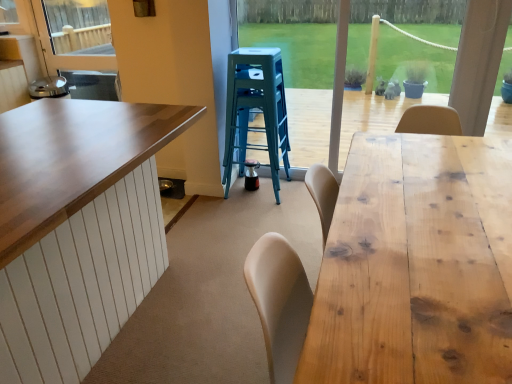
Question: Is natural wood table at right thinner than wooden frame at center?

Choices:
 (A) yes
 (B) no

Answer: (B)

Question: Is the position of natural wood table at right more distant than that of wooden frame at center?

Choices:
 (A) no
 (B) yes

Answer: (A)

Question: Is natural wood table at right with wooden frame at center?

Choices:
 (A) yes
 (B) no

Answer: (B)

Question: Are natural wood table at right and wooden frame at center far apart?

Choices:
 (A) yes
 (B) no

Answer: (A)

Question: Considering the relative sizes of natural wood table at right and wooden frame at center in the image provided, is natural wood table at right bigger than wooden frame at center?

Choices:
 (A) no
 (B) yes

Answer: (B)

Question: Does natural wood table at right have a smaller size compared to wooden frame at center?

Choices:
 (A) yes
 (B) no

Answer: (B)

Question: From the image's perspective, does natural wood table at right appear higher than teal plastic stool at center?

Choices:
 (A) no
 (B) yes

Answer: (A)

Question: Is natural wood table at right oriented towards teal plastic stool at center?

Choices:
 (A) no
 (B) yes

Answer: (A)

Question: Is natural wood table at right shorter than teal plastic stool at center?

Choices:
 (A) yes
 (B) no

Answer: (A)

Question: Is natural wood table at right not inside teal plastic stool at center?

Choices:
 (A) no
 (B) yes

Answer: (B)

Question: Considering the relative positions of natural wood table at right and teal plastic stool at center in the image provided, is natural wood table at right to the left of teal plastic stool at center from the viewer's perspective?

Choices:
 (A) no
 (B) yes

Answer: (A)

Question: Is teal plastic stool at center completely or partially inside natural wood table at right?

Choices:
 (A) yes
 (B) no

Answer: (B)

Question: From a real-world perspective, is teal plastic stool at center located higher than natural wood table at right?

Choices:
 (A) yes
 (B) no

Answer: (A)